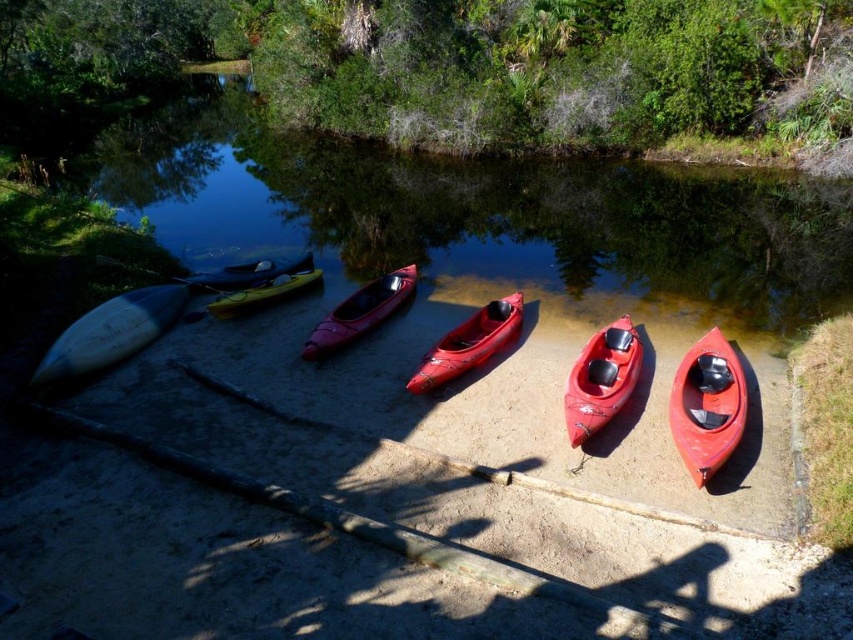
Question: Is matte red kayak at lower right smaller than white plastic paddle at left?

Choices:
 (A) yes
 (B) no

Answer: (B)

Question: Is the position of white matte canoe at left more distant than that of glossy plastic canoe at center?

Choices:
 (A) no
 (B) yes

Answer: (A)

Question: Which object appears farthest from the camera in this image?

Choices:
 (A) matte red kayak at lower right
 (B) white plastic paddle at left

Answer: (B)

Question: Which point is farther to the camera?

Choices:
 (A) (109, 257)
 (B) (726, 346)
 (C) (321, 323)

Answer: (A)

Question: Estimate the real-world distances between objects in this image. Which object is closer to the matte red kayak at center?

Choices:
 (A) glossy plastic canoe at center
 (B) matte red canoe at center

Answer: (A)

Question: Is white matte canoe at left positioned in front of glossy plastic canoe at center?

Choices:
 (A) yes
 (B) no

Answer: (A)